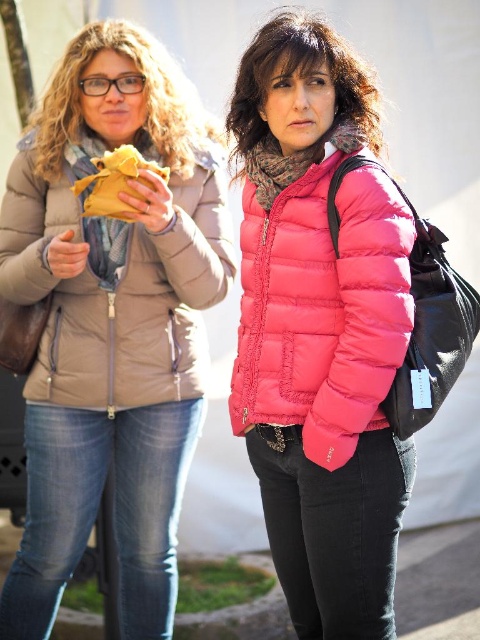
Question: Which point is closer to the camera taking this photo?

Choices:
 (A) (172, 396)
 (B) (173, 388)
 (C) (81, 179)

Answer: (C)

Question: Among these objects, which one is farthest from the camera?

Choices:
 (A) matte brown jacket at left
 (B) matte beige jacket at left

Answer: (B)

Question: Is matte brown jacket at left to the right of yellow paper bag at left from the viewer's perspective?

Choices:
 (A) yes
 (B) no

Answer: (A)

Question: Can you confirm if matte brown jacket at left is positioned below yellow paper bag at left?

Choices:
 (A) yes
 (B) no

Answer: (A)

Question: Does matte brown jacket at left appear on the right side of matte beige jacket at left?

Choices:
 (A) yes
 (B) no

Answer: (B)

Question: Among these points, which one is farthest from the camera?

Choices:
 (A) (73, 380)
 (B) (94, 192)
 (C) (166, 243)

Answer: (A)